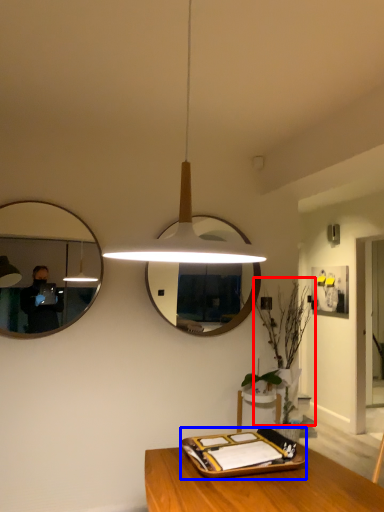
Question: Which point is closer to the camera, plant (highlighted by a red box) or tray (highlighted by a blue box)?

Choices:
 (A) plant
 (B) tray

Answer: (B)